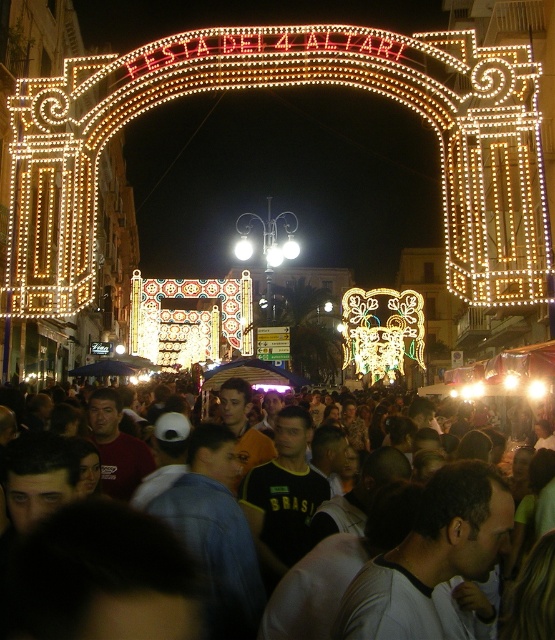
You are at the Festa Dei 4 Altari celebration and want to take a photo of the illuminated neon sign at upper center while also capturing the dark gray clothing at center in the frame. Which object should you position to the left side of your camera frame to include both in the photo?

To include both the illuminated neon sign at upper center and the dark gray clothing at center in your photo, you should position the dark gray clothing at center on the left side of your camera frame since the illuminated neon sign at upper center is on the right side of it.

You are a photographer standing in the crowd at the Festa Dei 4 Altari event. You want to capture a photo that includes both the illuminated neon sign at upper center and the dark gray clothing at center. Since the sign is much taller than the dark gray clothing, how should you adjust your camera angle to ensure both are visible in the frame?

To include both the illuminated neon sign at upper center and the dark gray clothing at center in the photo, tilt your camera downward slightly so that the taller neon sign fits within the upper part of the frame while keeping the dark gray clothing at center in the lower portion. This adjustment accounts for the height difference between the two objects.

You are standing at the entrance of the event and want to locate the illuminated neon sign at upper center. According to the coordinates provided, where exactly should you look to find it?

The illuminated neon sign at upper center is located at point (280, 84), so you should look towards the upper center area of the image where those coordinates are marked.